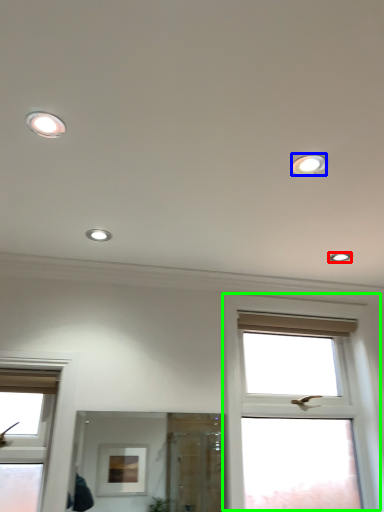
Question: Which object is the closest to the dot (highlighted by a red box)? Choose among these: dot (highlighted by a blue box) or window (highlighted by a green box).

Choices:
 (A) dot
 (B) window

Answer: (B)